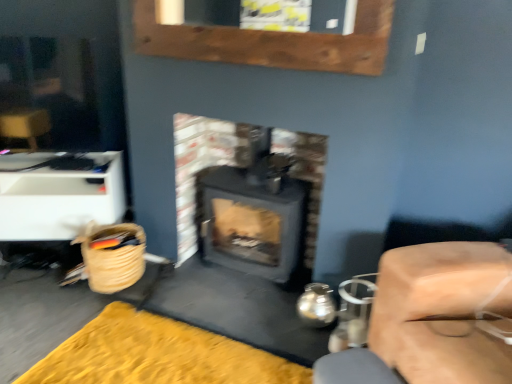
I want to click on yellow plush rug at lower left, so click(x=157, y=355).

In the scene shown: Measure the distance between smooth beige cushion at right, which is the 2th furniture in left-to-right order, and camera.

They are 1.27 meters apart.

This screenshot has width=512, height=384. What do you see at coordinates (112, 258) in the screenshot?
I see `woven straw basket at lower left` at bounding box center [112, 258].

I want to click on matte black wood burning stove at center, so click(x=250, y=196).

Based on the photo, is matte black wood burning stove at center positioned with its back to white plastic drawer at left, arranged as the second furniture when viewed from the right?

No, matte black wood burning stove at center's orientation is not away from white plastic drawer at left, arranged as the second furniture when viewed from the right.

Which of these two, matte black wood burning stove at center or white plastic drawer at left, which is counted as the second furniture, starting from the front, is wider?

white plastic drawer at left, which is counted as the second furniture, starting from the front.

Is matte black wood burning stove at center in front of or behind white plastic drawer at left, which is counted as the second furniture, starting from the front, in the image?

In the image, matte black wood burning stove at center appears in front of white plastic drawer at left, which is counted as the second furniture, starting from the front.

Considering the sizes of objects matte black wood burning stove at center and white plastic drawer at left, arranged as the second furniture when viewed from the right, in the image provided, who is shorter, matte black wood burning stove at center or white plastic drawer at left, arranged as the second furniture when viewed from the right,?

Standing shorter between the two is white plastic drawer at left, arranged as the second furniture when viewed from the right.

How many degrees apart are the facing directions of yellow plush rug at lower left and matte black wood burning stove at center?

There is a 2.92-degree angle between the facing directions of yellow plush rug at lower left and matte black wood burning stove at center.

From a real-world perspective, is yellow plush rug at lower left on top of matte black wood burning stove at center?

No, from a real-world perspective, yellow plush rug at lower left is not on top of matte black wood burning stove at center.

Based on the photo, which is more to the left, yellow plush rug at lower left or matte black wood burning stove at center?

yellow plush rug at lower left.

In the scene shown: Which of these two, yellow plush rug at lower left or matte black wood burning stove at center, is bigger?

Bigger between the two is matte black wood burning stove at center.

From a real-world perspective, which object rests below the other?

From a 3D spatial view, white plastic drawer at left, arranged as the second furniture when viewed from the right, is below.

Is there a large distance between white plastic drawer at left, acting as the 1th furniture starting from the back, and matte black wood burning stove at center?

Actually, white plastic drawer at left, acting as the 1th furniture starting from the back, and matte black wood burning stove at center are a little close together.

Considering the relative sizes of white plastic drawer at left, arranged as the second furniture when viewed from the right, and matte black wood burning stove at center in the image provided, is white plastic drawer at left, arranged as the second furniture when viewed from the right, thinner than matte black wood burning stove at center?

In fact, white plastic drawer at left, arranged as the second furniture when viewed from the right, might be wider than matte black wood burning stove at center.

Could you tell me if yellow plush rug at lower left is turned towards smooth beige cushion at right, acting as the 1th furniture starting from the right?

No, yellow plush rug at lower left is not oriented towards smooth beige cushion at right, acting as the 1th furniture starting from the right.

Is yellow plush rug at lower left bigger than smooth beige cushion at right, which is the first furniture in front-to-back order?

No.

From the image's perspective, who appears lower, yellow plush rug at lower left or smooth beige cushion at right, placed as the 2th furniture when sorted from back to front?

yellow plush rug at lower left.

Is yellow plush rug at lower left outside of woven straw basket at lower left?

yellow plush rug at lower left is positioned outside woven straw basket at lower left.

From a real-world perspective, which object rests below the other?

In real-world perspective, yellow plush rug at lower left is lower.

Is yellow plush rug at lower left beside woven straw basket at lower left?

They are not placed beside each other.

Does point (122, 354) come behind point (99, 264)?

No, it is not.

Which object is positioned more to the right, matte black wood burning stove at center or woven straw basket at lower left?

Positioned to the right is matte black wood burning stove at center.

From a real-world perspective, who is located higher, matte black wood burning stove at center or woven straw basket at lower left?

From a 3D spatial view, matte black wood burning stove at center is above.

Can you confirm if matte black wood burning stove at center is thinner than woven straw basket at lower left?

Yes, matte black wood burning stove at center is thinner than woven straw basket at lower left.

In terms of height, does woven straw basket at lower left look taller or shorter compared to white plastic drawer at left, which is counted as the second furniture, starting from the front?

Considering their sizes, woven straw basket at lower left has less height than white plastic drawer at left, which is counted as the second furniture, starting from the front.

Which is in front, point (106, 234) or point (18, 198)?

Positioned in front is point (106, 234).

Which object is thinner, woven straw basket at lower left or white plastic drawer at left, acting as the 1th furniture starting from the back?

Thinner between the two is woven straw basket at lower left.

Visually, is woven straw basket at lower left positioned to the left or to the right of white plastic drawer at left, acting as the 1th furniture starting from the back?

Based on their positions, woven straw basket at lower left is located to the right of white plastic drawer at left, acting as the 1th furniture starting from the back.

Identify the location of wood burning stove in front of the white plastic drawer at left, which is counted as the second furniture, starting from the front. The image size is (512, 384). (250, 196).

The height and width of the screenshot is (384, 512). I want to click on wood burning stove lying on the right of yellow plush rug at lower left, so click(250, 196).

From the image, which object appears to be farther from white plastic drawer at left, acting as the 1th furniture starting from the back, smooth beige cushion at right, acting as the 1th furniture starting from the right, or matte black wood burning stove at center?

smooth beige cushion at right, acting as the 1th furniture starting from the right, is further to white plastic drawer at left, acting as the 1th furniture starting from the back.

From the picture: When comparing their distances from yellow plush rug at lower left, does smooth beige cushion at right, acting as the 1th furniture starting from the right, or white plastic drawer at left, acting as the 1th furniture starting from the back, seem further?

The object further to yellow plush rug at lower left is white plastic drawer at left, acting as the 1th furniture starting from the back.

Considering their positions, is matte black wood burning stove at center positioned closer to white plastic drawer at left, arranged as the second furniture when viewed from the right, than yellow plush rug at lower left?

matte black wood burning stove at center lies closer to white plastic drawer at left, arranged as the second furniture when viewed from the right, than the other object.

Based on their spatial positions, is woven straw basket at lower left or yellow plush rug at lower left closer to smooth beige cushion at right, placed as the 2th furniture when sorted from back to front?

Based on the image, yellow plush rug at lower left appears to be nearer to smooth beige cushion at right, placed as the 2th furniture when sorted from back to front.

Which object lies further to the anchor point matte black wood burning stove at center, smooth beige cushion at right, acting as the 1th furniture starting from the right, or white plastic drawer at left, which is counted as the first furniture, starting from the left?

smooth beige cushion at right, acting as the 1th furniture starting from the right, lies further to matte black wood burning stove at center than the other object.

Based on their spatial positions, is white plastic drawer at left, acting as the 1th furniture starting from the back, or smooth beige cushion at right, placed as the 2th furniture when sorted from back to front, further from matte black wood burning stove at center?

Based on the image, smooth beige cushion at right, placed as the 2th furniture when sorted from back to front, appears to be further to matte black wood burning stove at center.

Based on their spatial positions, is yellow plush rug at lower left or smooth beige cushion at right, which is the 2th furniture in left-to-right order, further from woven straw basket at lower left?

The object further to woven straw basket at lower left is smooth beige cushion at right, which is the 2th furniture in left-to-right order.

Based on their spatial positions, is white plastic drawer at left, arranged as the second furniture when viewed from the right, or matte black wood burning stove at center further from smooth beige cushion at right, placed as the 2th furniture when sorted from back to front?

The object further to smooth beige cushion at right, placed as the 2th furniture when sorted from back to front, is white plastic drawer at left, arranged as the second furniture when viewed from the right.

This screenshot has width=512, height=384. In order to click on wood burning stove located between woven straw basket at lower left and smooth beige cushion at right, acting as the 1th furniture starting from the right, in the left-right direction in this screenshot , I will do `click(250, 196)`.

I want to click on basket between white plastic drawer at left, acting as the 1th furniture starting from the back, and smooth beige cushion at right, placed as the 2th furniture when sorted from back to front, so click(x=112, y=258).

You are a GUI agent. You are given a task and a screenshot of the screen. Output one action in this format:
    pyautogui.click(x=<x>, y=<y>)
    Task: Click on the doormat located between white plastic drawer at left, acting as the 1th furniture starting from the back, and smooth beige cushion at right, which is the 2th furniture in left-to-right order, in the left-right direction
    This screenshot has width=512, height=384.
    Given the screenshot: What is the action you would take?
    pyautogui.click(x=157, y=355)

I want to click on doormat between white plastic drawer at left, which is counted as the first furniture, starting from the left, and matte black wood burning stove at center, so click(x=157, y=355).